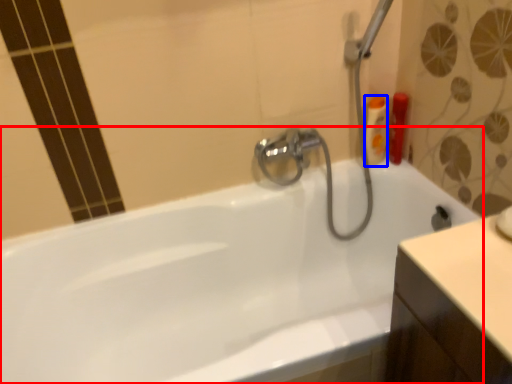
Question: Among these objects, which one is farthest to the camera, bathtub (highlighted by a red box) or toiletry (highlighted by a blue box)?

Choices:
 (A) bathtub
 (B) toiletry

Answer: (B)